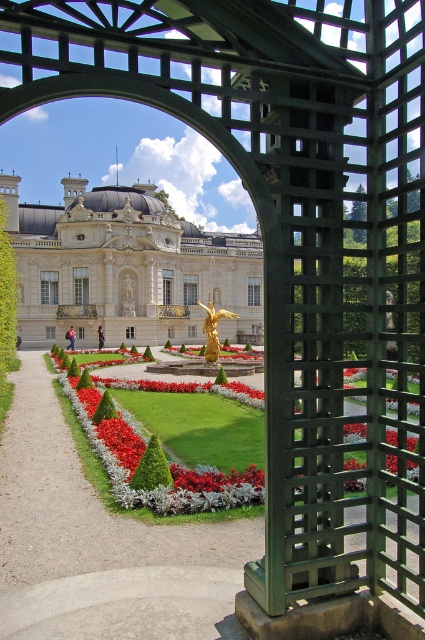
Question: Is gravel pathway at center smaller than gold polished statue at center?

Choices:
 (A) no
 (B) yes

Answer: (B)

Question: Among these points, which one is farthest from the camera?

Choices:
 (A) (10, 547)
 (B) (235, 316)
 (C) (158, 246)

Answer: (C)

Question: Which is nearer to the gravel pathway at center?

Choices:
 (A) gold polished statue at center
 (B) white glossy palace at center

Answer: (A)

Question: Does gravel pathway at center appear under white glossy palace at center?

Choices:
 (A) no
 (B) yes

Answer: (B)

Question: Which point is farther to the camera?

Choices:
 (A) (235, 314)
 (B) (203, 248)
 (C) (73, 576)

Answer: (B)

Question: Is the position of gravel pathway at center more distant than that of gold polished statue at center?

Choices:
 (A) yes
 (B) no

Answer: (B)